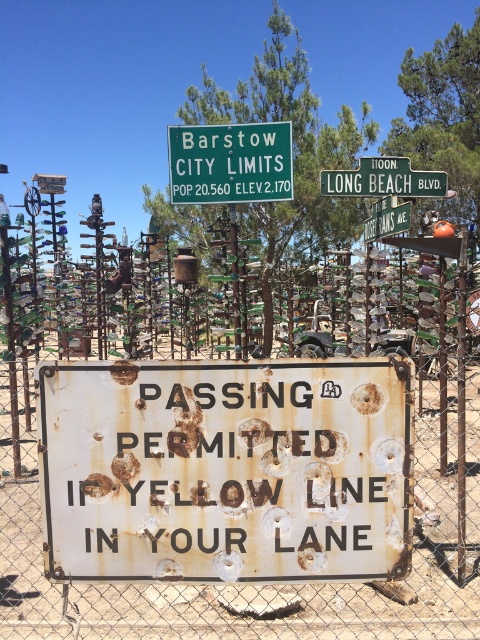
From the picture: You are driving a truck that is 10 feet wide. You see the rusty metal sign at center and the green metal sign at upper center. Can your truck pass through the space between them without touching either sign?

The rusty metal sign at center occupies less space than the green metal sign at upper center, so the space between them may be narrower than the truck width of 10 feet. The truck might not be able to pass through safely without touching either sign.

You are driving a car and see the rusty metal sign at center ahead. According to the sign, you can pass only if your lane has a yellow line. Your car is currently in a lane with a white line. What should you do?

According to the rusty metal sign at center, passing is permitted only if your lane has a yellow line. Since your lane has a white line, you should not pass and must continue driving forward without overtaking.